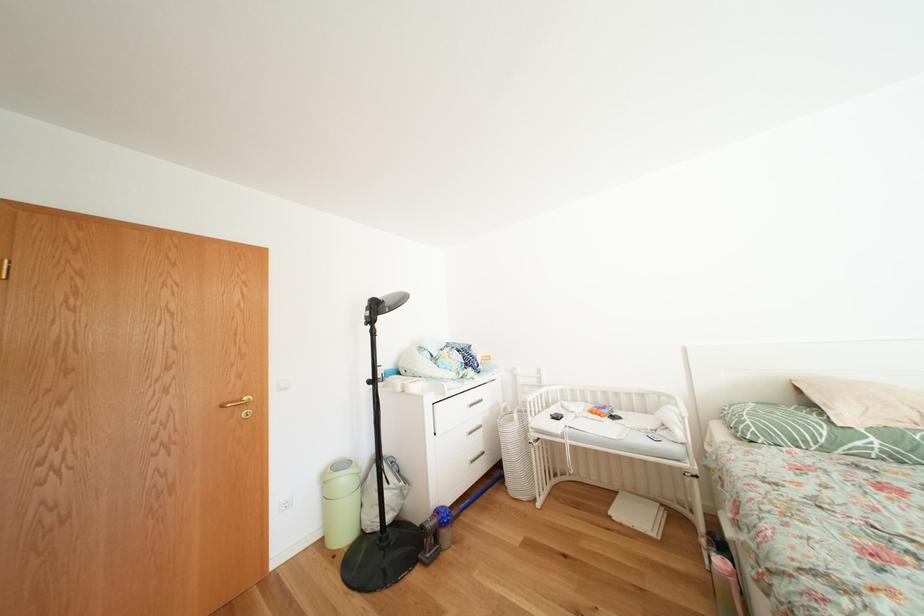
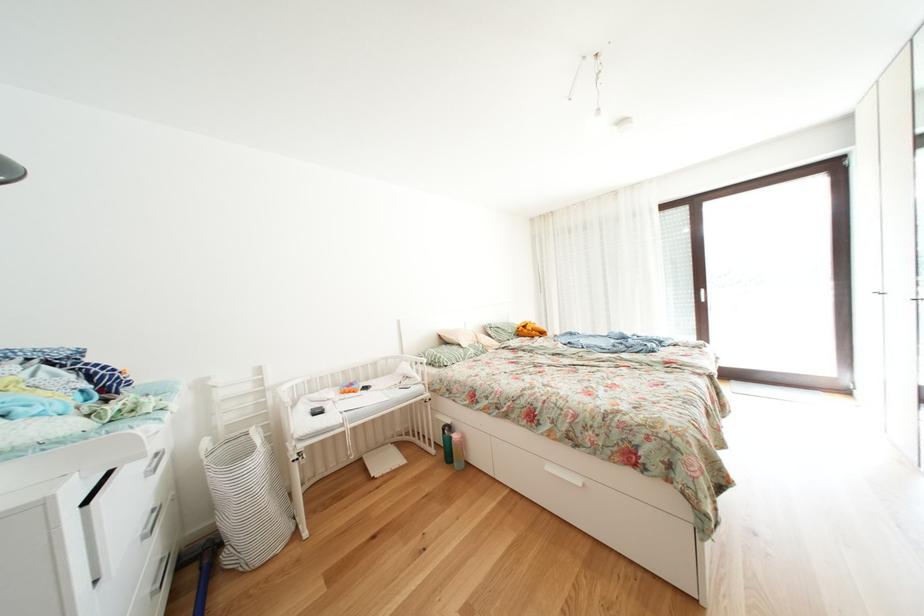
The point at (718,568) is marked in the first image. Where is the corresponding point in the second image?

(443, 456)